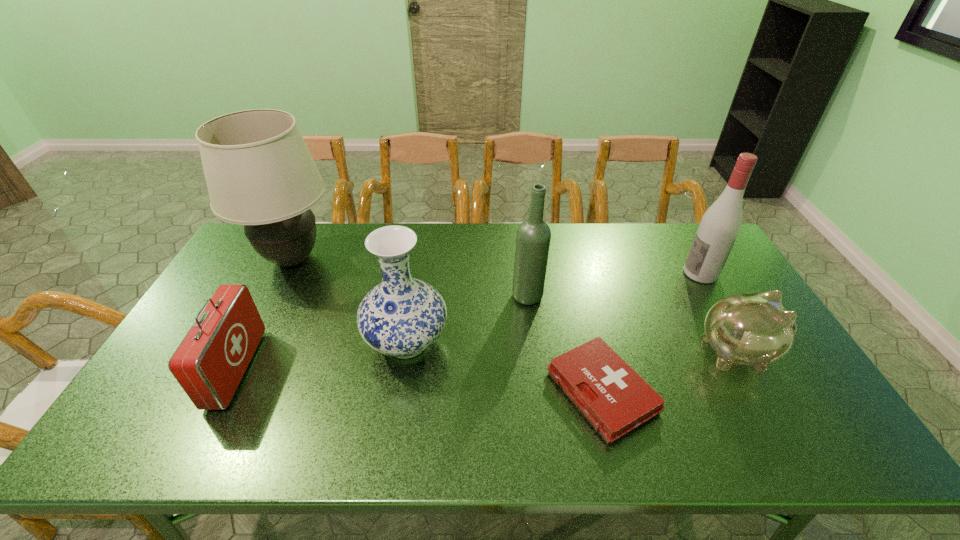
Identify which object is the fourth closest to the alcohol. Please provide its 2D coordinates. Your answer should be formatted as a tuple, i.e. [(x, y)], where the tuple contains the x and y coordinates of a point satisfying the conditions above.

[(401, 317)]

At what (x,y) coordinates should I click in order to perform the action: click on vacant space that satisfies the following two spatial constraints: 1. on the label of the alcohol; 2. on the front side of the vase. Please return your answer as a coordinate pair (x, y). This screenshot has height=540, width=960. Looking at the image, I should click on (740, 342).

Identify the location of vacant region that satisfies the following two spatial constraints: 1. on the label of the alcohol; 2. on the front side of the vase. (740, 342).

Locate an element on the screen. This screenshot has width=960, height=540. blank area in the image that satisfies the following two spatial constraints: 1. on the front side of the wine bottle; 2. on the side of the fifth tallest object with the first aid cross symbol is located at coordinates (537, 369).

I want to click on vacant space that satisfies the following two spatial constraints: 1. on the front side of the shorter first-aid kit; 2. on the right side of the wine bottle, so click(x=539, y=391).

Where is `free space that satisfies the following two spatial constraints: 1. on the back side of the wine bottle; 2. on the left side of the fifth object from right to left`? The image size is (960, 540). free space that satisfies the following two spatial constraints: 1. on the back side of the wine bottle; 2. on the left side of the fifth object from right to left is located at coordinates (415, 296).